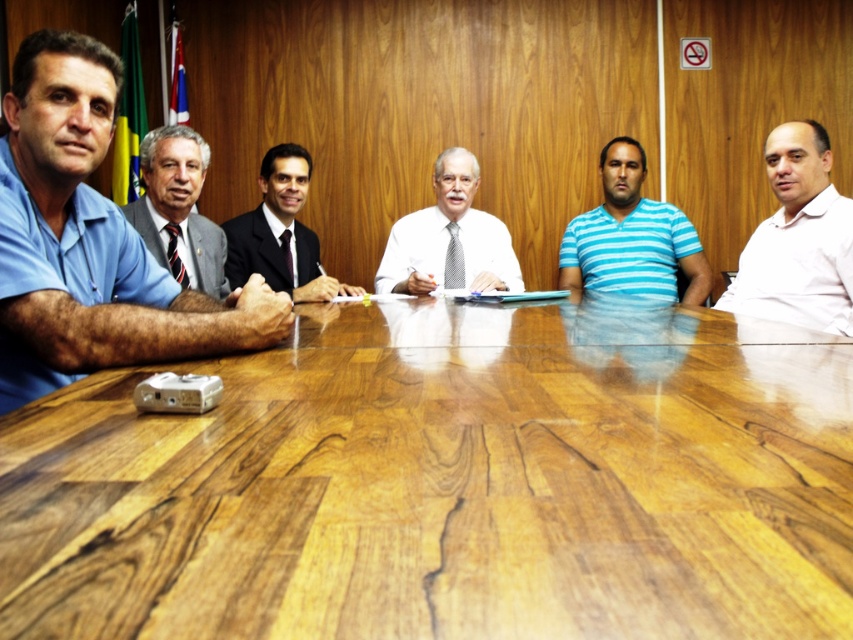
Question: Among these objects, which one is nearest to the camera?

Choices:
 (A) white matte shirt at right
 (B) white shirt at center

Answer: (A)

Question: Which point is farther to the camera?

Choices:
 (A) wooden table at center
 (B) dark suit at center
 (C) white shirt at center

Answer: (C)

Question: Is blue fabric shirt at left positioned in front of gray suit at center?

Choices:
 (A) yes
 (B) no

Answer: (A)

Question: Is blue fabric shirt at left to the right of white matte shirt at right from the viewer's perspective?

Choices:
 (A) yes
 (B) no

Answer: (B)

Question: Among these points, which one is nearest to the camera?

Choices:
 (A) (791, 141)
 (B) (195, 304)

Answer: (B)

Question: Where is blue fabric shirt at left located in relation to gray suit at center in the image?

Choices:
 (A) left
 (B) right

Answer: (B)